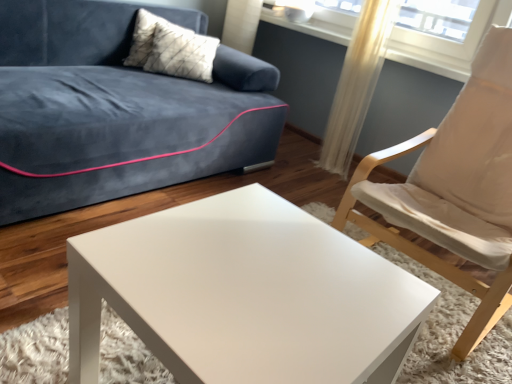
Where is `translucent fabric curtain at upper right`? translucent fabric curtain at upper right is located at coordinates (357, 84).

In order to click on white glossy coffee table at center in this screenshot , I will do `click(244, 295)`.

I want to click on white fabric chair at right, so click(x=455, y=188).

Is white textured pillow at upper left positioned with its back to translucent fabric curtain at upper right?

No, white textured pillow at upper left is not facing the opposite direction of translucent fabric curtain at upper right.

Between point (177, 26) and point (346, 144), which one is positioned behind?

The point (346, 144) is behind.

Between white textured pillow at upper left and translucent fabric curtain at upper right, which one has larger width?

Wider between the two is white textured pillow at upper left.

Considering the sizes of objects white textured pillow at upper left and translucent fabric curtain at upper right in the image provided, who is taller, white textured pillow at upper left or translucent fabric curtain at upper right?

Standing taller between the two is translucent fabric curtain at upper right.

Considering the relative sizes of white textured pillow at upper left and white fabric chair at right in the image provided, is white textured pillow at upper left wider than white fabric chair at right?

No, white textured pillow at upper left is not wider than white fabric chair at right.

Which object is positioned more to the left, white textured pillow at upper left or white fabric chair at right?

white textured pillow at upper left is more to the left.

Is the position of white textured pillow at upper left more distant than that of white fabric chair at right?

Yes, it is.

Is white textured pillow at upper left positioned with its back to white fabric chair at right?

No, white textured pillow at upper left is not facing the opposite direction of white fabric chair at right.

This screenshot has height=384, width=512. I want to click on chair in front of the white textured pillow at upper left, so point(455,188).

In the scene shown: Is white fabric chair at right at the left side of white textured pillow at upper left?

Incorrect, white fabric chair at right is not on the left side of white textured pillow at upper left.

Does white fabric chair at right have a greater height compared to white textured pillow at upper left?

Yes, white fabric chair at right is taller than white textured pillow at upper left.

Is point (396, 218) closer to camera compared to point (208, 38)?

Yes, it is in front of point (208, 38).

Does white glossy coffee table at center have a smaller size compared to white fabric chair at right?

Indeed, white glossy coffee table at center has a smaller size compared to white fabric chair at right.

From the image's perspective, would you say white glossy coffee table at center is shown under white fabric chair at right?

Indeed, from the image's perspective, white glossy coffee table at center is shown beneath white fabric chair at right.

From the picture: Could white fabric chair at right be considered to be inside white glossy coffee table at center?

No, white fabric chair at right is not inside white glossy coffee table at center.

Based on the photo, which of these two, white glossy coffee table at center or white fabric chair at right, stands taller?

white fabric chair at right.

What's the angular difference between translucent fabric curtain at upper right and white fabric chair at right's facing directions?

3.05 degrees separate the facing orientations of translucent fabric curtain at upper right and white fabric chair at right.

Can you confirm if translucent fabric curtain at upper right is taller than white fabric chair at right?

Correct, translucent fabric curtain at upper right is much taller as white fabric chair at right.

From the image's perspective, is translucent fabric curtain at upper right under white fabric chair at right?

Actually, translucent fabric curtain at upper right appears above white fabric chair at right in the image.

Would you say white textured pillow at upper left is part of white glossy coffee table at center's contents?

No, white textured pillow at upper left is not a part of white glossy coffee table at center.

Is white glossy coffee table at center not close to white textured pillow at upper left?

Yes.

Who is taller, white glossy coffee table at center or white textured pillow at upper left?

Standing taller between the two is white glossy coffee table at center.

Which is behind, white glossy coffee table at center or white textured pillow at upper left?

Positioned behind is white textured pillow at upper left.

Considering the sizes of objects translucent fabric curtain at upper right and white glossy coffee table at center in the image provided, who is shorter, translucent fabric curtain at upper right or white glossy coffee table at center?

white glossy coffee table at center is shorter.

How much distance is there between translucent fabric curtain at upper right and white glossy coffee table at center?

translucent fabric curtain at upper right is 1.70 meters from white glossy coffee table at center.

Between translucent fabric curtain at upper right and white glossy coffee table at center, which one has larger width?

white glossy coffee table at center is wider.

Between translucent fabric curtain at upper right and white glossy coffee table at center, which one has larger size?

Bigger between the two is white glossy coffee table at center.

Where is `pillow behind the translucent fabric curtain at upper right`? pillow behind the translucent fabric curtain at upper right is located at coordinates (170, 49).

Where is `pillow that is above the white fabric chair at right (from the image's perspective)`? pillow that is above the white fabric chair at right (from the image's perspective) is located at coordinates (170, 49).

Which object lies nearer to the anchor point white fabric chair at right, translucent fabric curtain at upper right or white textured pillow at upper left?

Based on the image, translucent fabric curtain at upper right appears to be nearer to white fabric chair at right.

Based on their spatial positions, is white glossy coffee table at center or translucent fabric curtain at upper right closer to white fabric chair at right?

The object closer to white fabric chair at right is white glossy coffee table at center.

Which object lies nearer to the anchor point translucent fabric curtain at upper right, white textured pillow at upper left or white fabric chair at right?

white fabric chair at right is closer to translucent fabric curtain at upper right.

Based on the photo, which object lies further to the anchor point translucent fabric curtain at upper right, white glossy coffee table at center or white fabric chair at right?

white glossy coffee table at center is positioned further to the anchor translucent fabric curtain at upper right.

Based on their spatial positions, is white glossy coffee table at center or white textured pillow at upper left further from white fabric chair at right?

white textured pillow at upper left is positioned further to the anchor white fabric chair at right.

In the scene shown: When comparing their distances from white textured pillow at upper left, does white glossy coffee table at center or white fabric chair at right seem closer?

Based on the image, white fabric chair at right appears to be nearer to white textured pillow at upper left.

Based on their spatial positions, is white textured pillow at upper left or translucent fabric curtain at upper right further from white glossy coffee table at center?

translucent fabric curtain at upper right.

Looking at the image, which one is located closer to white glossy coffee table at center, translucent fabric curtain at upper right or white fabric chair at right?

white fabric chair at right.

The width and height of the screenshot is (512, 384). What are the coordinates of `curtain between white glossy coffee table at center and white textured pillow at upper left in the front-back direction` in the screenshot? It's located at (357, 84).

Where is `curtain between white fabric chair at right and white textured pillow at upper left along the z-axis`? The image size is (512, 384). curtain between white fabric chair at right and white textured pillow at upper left along the z-axis is located at coordinates tap(357, 84).

Identify the location of chair positioned between white glossy coffee table at center and translucent fabric curtain at upper right from near to far. (455, 188).

Find the location of a particular element. The height and width of the screenshot is (384, 512). chair positioned between white glossy coffee table at center and white textured pillow at upper left from near to far is located at coordinates (455, 188).